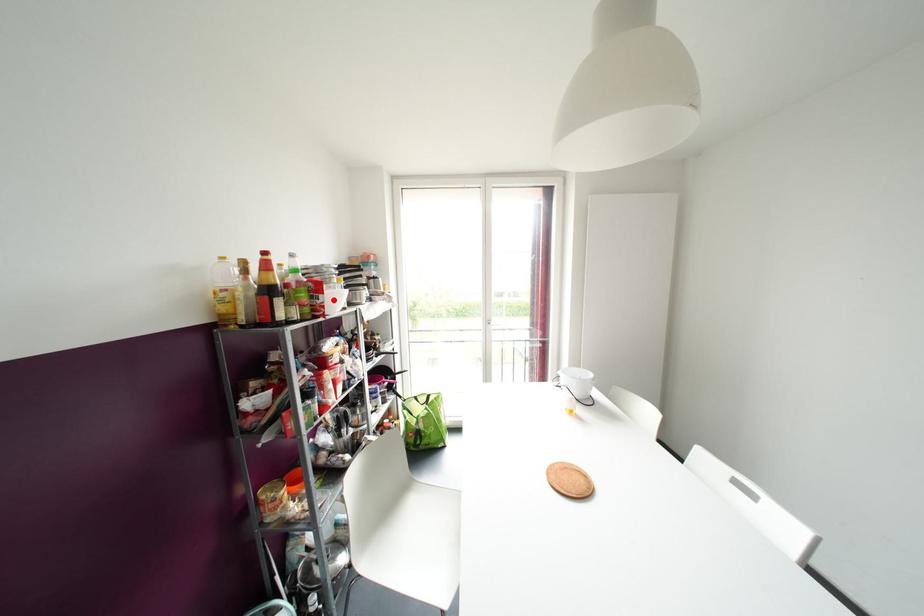
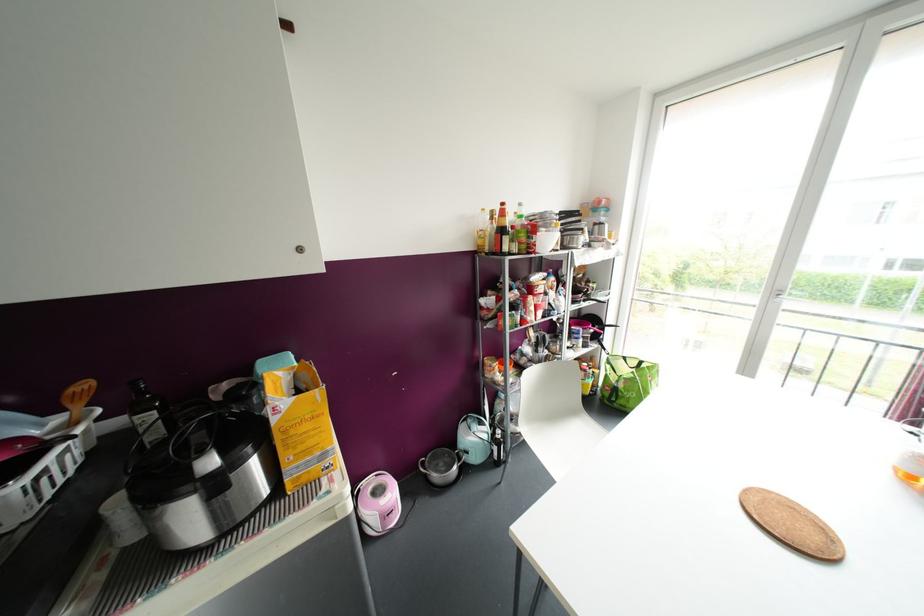
Locate, in the second image, the point that corresponds to the highlighted location in the first image.

(546, 241)